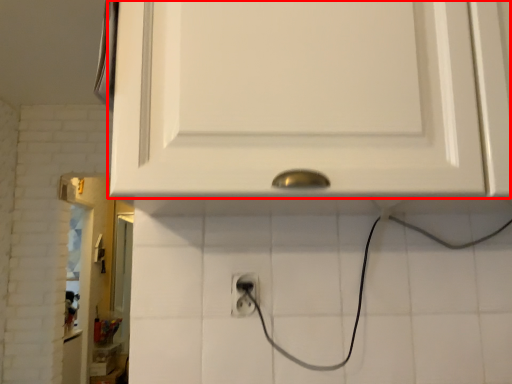
Question: In this image, where is cabinetry (annotated by the red box) located relative to power plugs and sockets?

Choices:
 (A) right
 (B) left

Answer: (A)